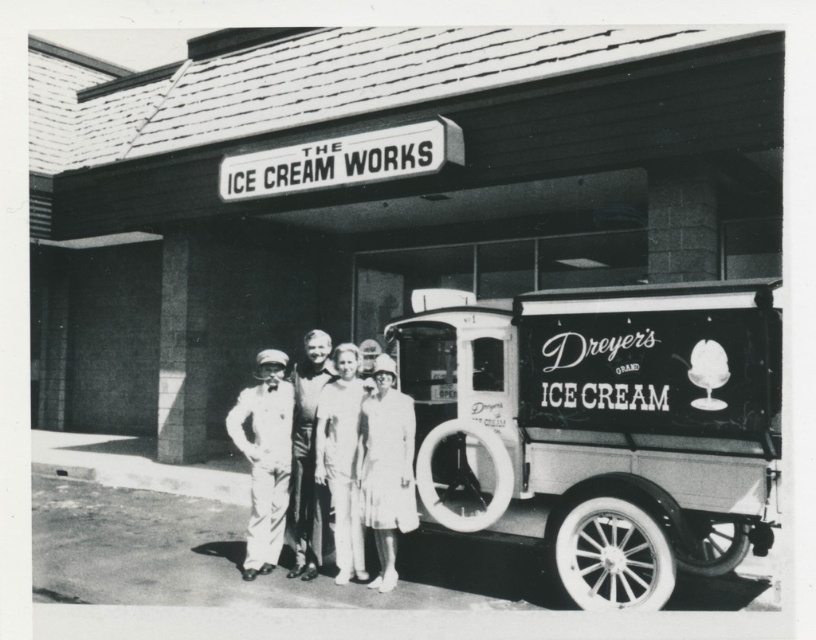
Question: Which of the following is the farthest from the observer?

Choices:
 (A) (336, 372)
 (B) (570, 225)
 (C) (322, 372)
 (D) (723, 486)

Answer: (B)

Question: Among these points, which one is nearest to the camera?

Choices:
 (A) (285, 476)
 (B) (360, 474)

Answer: (B)

Question: Which point is farther to the camera?

Choices:
 (A) (178, 340)
 (B) (348, 397)

Answer: (A)

Question: Is smooth concrete wall at center positioned behind white cotton dress at center?

Choices:
 (A) yes
 (B) no

Answer: (A)

Question: Does smooth concrete wall at center appear on the right side of white cotton suit at center?

Choices:
 (A) yes
 (B) no

Answer: (A)

Question: Is smooth concrete wall at center smaller than white cotton dress at center?

Choices:
 (A) yes
 (B) no

Answer: (B)